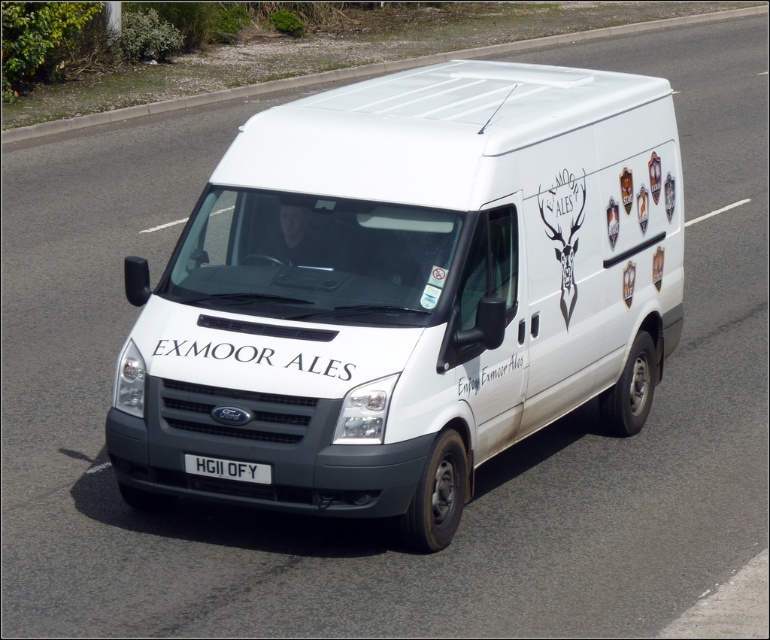
Does white matte van at center appear on the right side of white plastic license plate at center?

Yes, white matte van at center is to the right of white plastic license plate at center.

Which is more to the right, white matte van at center or white plastic license plate at center?

Positioned to the right is white matte van at center.

The height and width of the screenshot is (640, 770). Find the location of `white matte van at center`. white matte van at center is located at coordinates (407, 291).